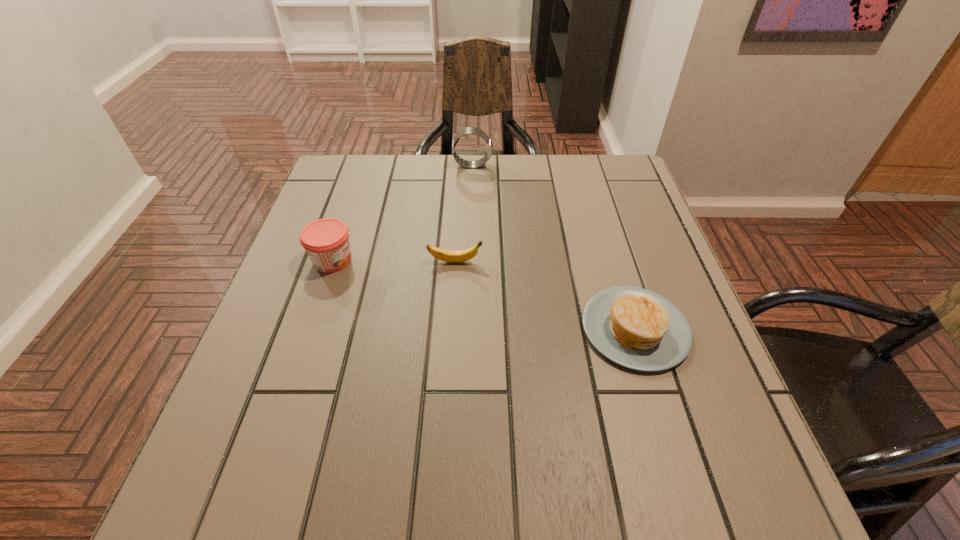
Image resolution: width=960 pixels, height=540 pixels. What are the coordinates of `vacant space at the near right corner of the desktop` in the screenshot? It's located at (677, 468).

Locate an element on the screen. vacant space that's between the farthest object and the rightmost object is located at coordinates (554, 247).

Locate an element on the screen. This screenshot has width=960, height=540. vacant area that lies between the banana and the jam is located at coordinates (394, 261).

Find the location of a particular element. free spot between the nearest object and the banana is located at coordinates (545, 295).

Identify the location of blank region between the leftmost object and the pancake. (484, 294).

Where is `free spot between the second tallest object and the farthest object`? The image size is (960, 540). free spot between the second tallest object and the farthest object is located at coordinates (402, 213).

Locate an element on the screen. free space that is in between the tallest object and the rightmost object is located at coordinates (554, 247).

Where is `free space between the jam and the banana`? This screenshot has width=960, height=540. free space between the jam and the banana is located at coordinates (394, 261).

Identify the location of vacant area that lies between the jam and the banana. (394, 261).

Locate an element on the screen. The width and height of the screenshot is (960, 540). free space that is in between the pancake and the watch is located at coordinates (554, 247).